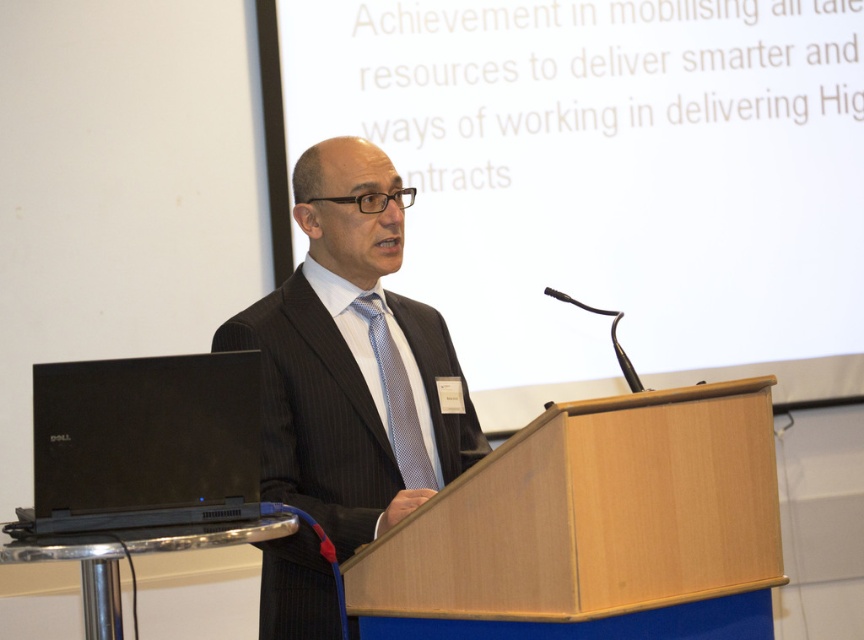
You are an event organizer who needs to arrange a photo shoot. You want to ensure that both the dark pinstripe suit at center and the black matte laptop at lower left are visible in the frame. Considering their sizes, which object should you position closer to the camera to maintain balance in the composition?

The dark pinstripe suit at center is much taller than the black matte laptop at lower left. To balance the composition, you should position the black matte laptop at lower left closer to the camera so it appears larger in the frame, while keeping the dark pinstripe suit at center slightly farther back.

You are standing at the back of the room and see two points marked on the floor. The first point is at point (x=653, y=442) and the second point is at point (x=312, y=209). Which point is closer to the speaker?

Point (x=653, y=442) is in front of point (x=312, y=209), so it is closer to the speaker.